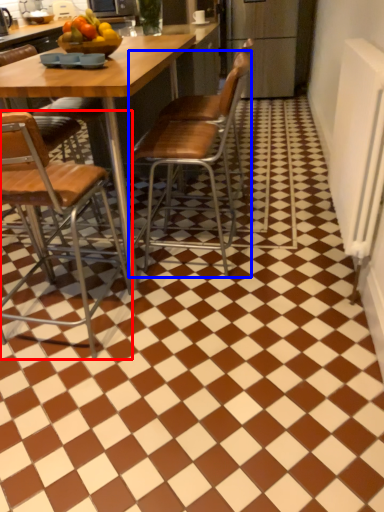
Question: Which of the following is the farthest to the observer, chair (highlighted by a red box) or chair (highlighted by a blue box)?

Choices:
 (A) chair
 (B) chair

Answer: (B)